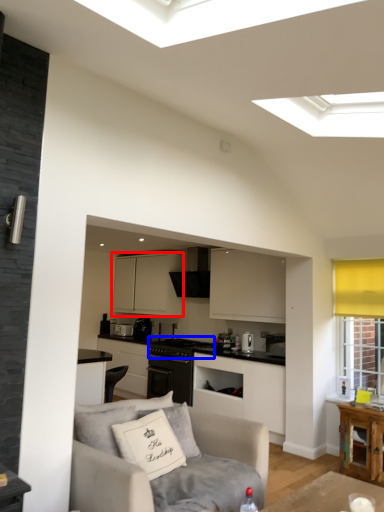
Question: Which object is further to the camera taking this photo, cabinetry (highlighted by a red box) or appliance (highlighted by a blue box)?

Choices:
 (A) cabinetry
 (B) appliance

Answer: (A)